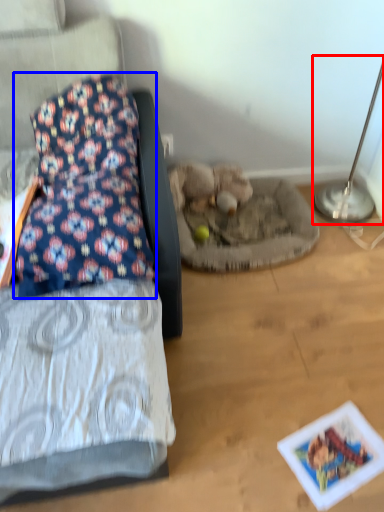
Question: Which object is closer to the camera taking this photo, table lamp (highlighted by a red box) or pillow (highlighted by a blue box)?

Choices:
 (A) table lamp
 (B) pillow

Answer: (B)